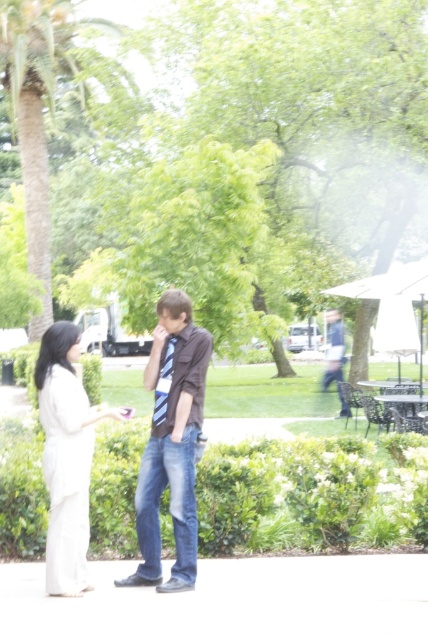
You are standing in the park and see the green leafy palm tree at left and the blue jeans at center. Which object is positioned more to the left side of the scene?

The green leafy palm tree at left is positioned to the left of the blue jeans at center, so it is more to the left side of the scene.

You are a photographer trying to capture a photo of the blue jeans at center without the green leafy palm tree at left blocking the view. Can you move to a position where the palm tree is out of frame while still keeping the blue jeans in the shot?

The green leafy palm tree at left is bigger than the blue jeans at center, so it might block the view. However, since the palm tree is at the left and the jeans are at the center, moving to the right side might allow you to position the jeans in the center while keeping the palm tree out of frame.